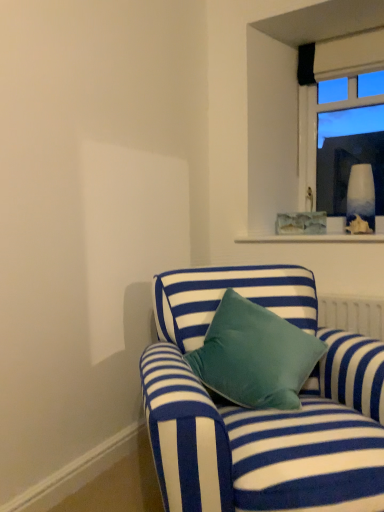
Question: Should I look upward or downward to see blue striped fabric couch at lower center?

Choices:
 (A) up
 (B) down

Answer: (B)

Question: Does blue striped fabric couch at lower center appear on the left side of clear glass window at upper right?

Choices:
 (A) yes
 (B) no

Answer: (A)

Question: From the image's perspective, is blue striped fabric couch at lower center on clear glass window at upper right?

Choices:
 (A) yes
 (B) no

Answer: (B)

Question: Does blue striped fabric couch at lower center appear on the right side of clear glass window at upper right?

Choices:
 (A) no
 (B) yes

Answer: (A)

Question: Is blue striped fabric couch at lower center further to camera compared to clear glass window at upper right?

Choices:
 (A) yes
 (B) no

Answer: (B)

Question: Is blue striped fabric couch at lower center placed right next to clear glass window at upper right?

Choices:
 (A) no
 (B) yes

Answer: (A)

Question: Is blue striped fabric couch at lower center aimed at clear glass window at upper right?

Choices:
 (A) yes
 (B) no

Answer: (B)

Question: Could you tell me if clear glass window at upper right is turned towards blue striped fabric couch at lower center?

Choices:
 (A) no
 (B) yes

Answer: (B)

Question: Considering the relative sizes of clear glass window at upper right and blue striped fabric couch at lower center in the image provided, is clear glass window at upper right taller than blue striped fabric couch at lower center?

Choices:
 (A) no
 (B) yes

Answer: (B)

Question: Is clear glass window at upper right directly adjacent to blue striped fabric couch at lower center?

Choices:
 (A) yes
 (B) no

Answer: (B)

Question: From a real-world perspective, is clear glass window at upper right below blue striped fabric couch at lower center?

Choices:
 (A) yes
 (B) no

Answer: (B)

Question: From a real-world perspective, is clear glass window at upper right on top of blue striped fabric couch at lower center?

Choices:
 (A) yes
 (B) no

Answer: (A)

Question: Would you say clear glass window at upper right contains blue striped fabric couch at lower center?

Choices:
 (A) no
 (B) yes

Answer: (A)

Question: In terms of width, does clear glass window at upper right look wider or thinner when compared to blue striped fabric couch at lower center?

Choices:
 (A) wide
 (B) thin

Answer: (B)